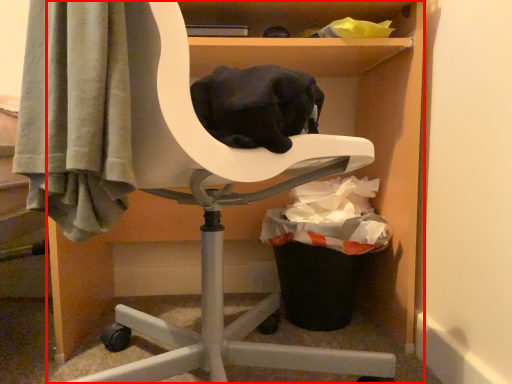
Question: From the image's perspective, where is furniture (annotated by the red box) located in relation to garbage in the image?

Choices:
 (A) above
 (B) below

Answer: (A)